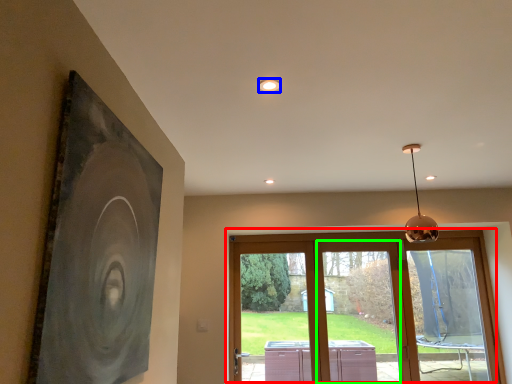
Question: Which object is the closest to the window (highlighted by a red box)? Choose among these: lighting (highlighted by a blue box) or window (highlighted by a green box).

Choices:
 (A) lighting
 (B) window

Answer: (B)